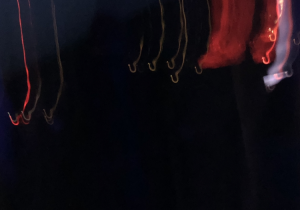
Image resolution: width=300 pixels, height=210 pixels. I want to click on long grey hook toward left, so click(38, 95), click(59, 96).